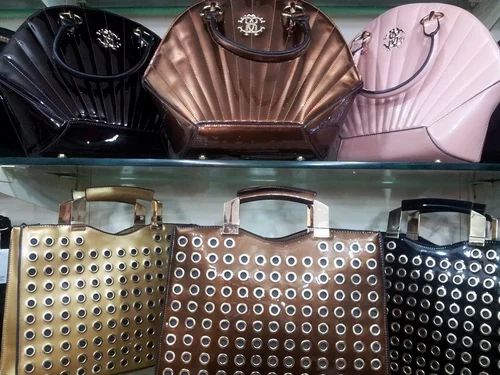
The height and width of the screenshot is (375, 500). I want to click on shelf, so pyautogui.click(x=156, y=161).